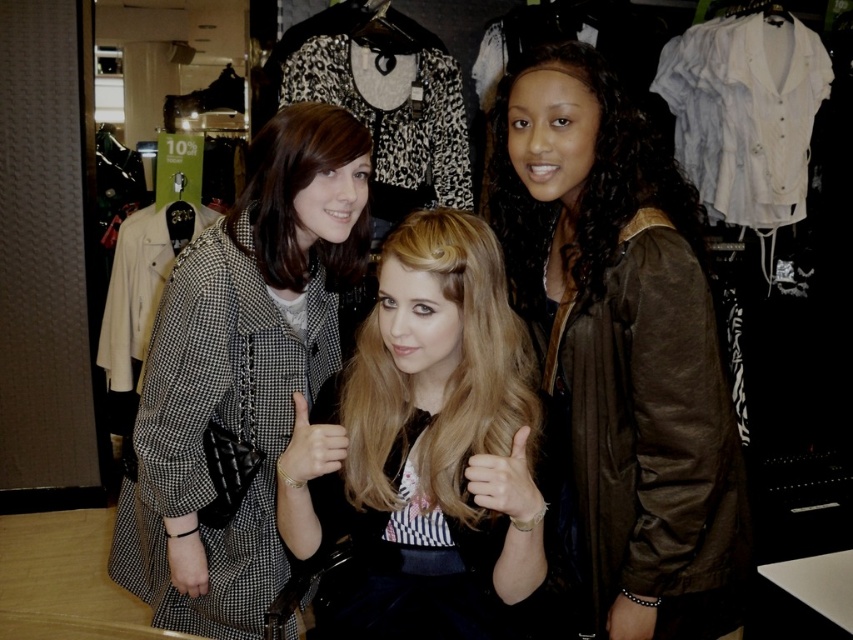
Question: Is brown leather jacket at right to the right of gold metallic bracelet at center from the viewer's perspective?

Choices:
 (A) no
 (B) yes

Answer: (B)

Question: Is checkered fabric coat at center bigger than gold metallic bracelet at center?

Choices:
 (A) no
 (B) yes

Answer: (B)

Question: Which point is closer to the camera taking this photo?

Choices:
 (A) 610,621
 (B) 569,381
 (C) 495,476
 (D) 309,472

Answer: (C)

Question: Which point is farther to the camera?

Choices:
 (A) (635, 636)
 (B) (281, 461)
 (C) (142, 470)
 (D) (608, 84)

Answer: (C)

Question: Among these objects, which one is nearest to the camera?

Choices:
 (A) smooth skin hand at center
 (B) brown leather jacket at right
 (C) matte black dress at center

Answer: (A)

Question: Is checkered fabric coat at center to the left of gold metallic bracelet at center from the viewer's perspective?

Choices:
 (A) no
 (B) yes

Answer: (B)